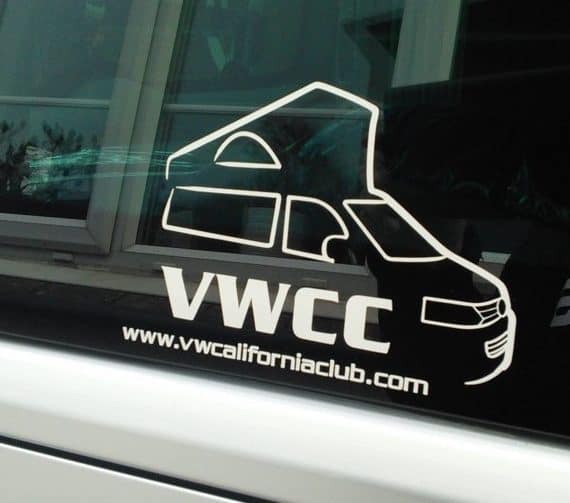
The image size is (570, 503). I want to click on drawing of windows, so click(398, 219), click(296, 216), click(222, 206).